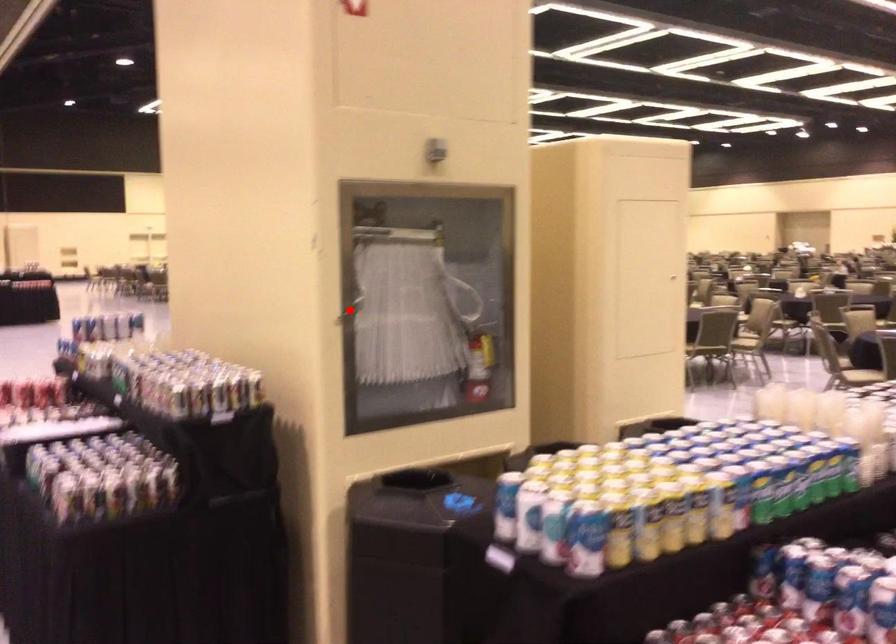
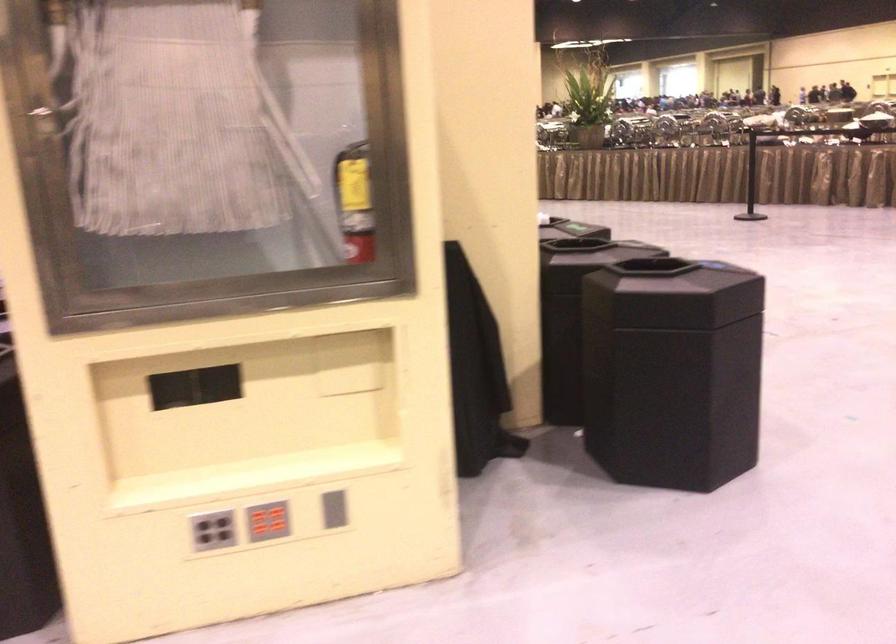
Question: I am providing you with two images of the same scene from different viewpoints. A red point is marked on the first image. Is the red point's position out of view in image 2?

Choices:
 (A) Yes
 (B) No

Answer: (A)